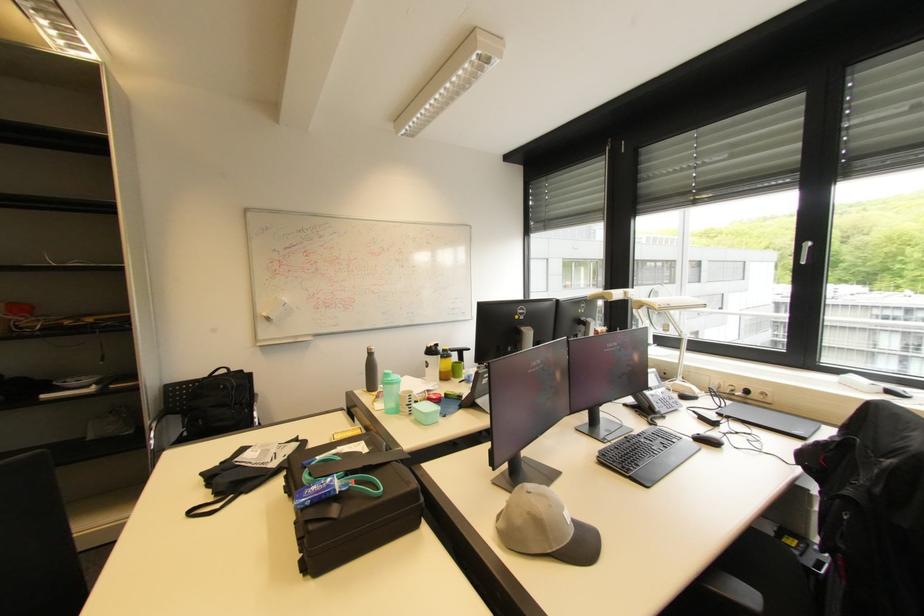
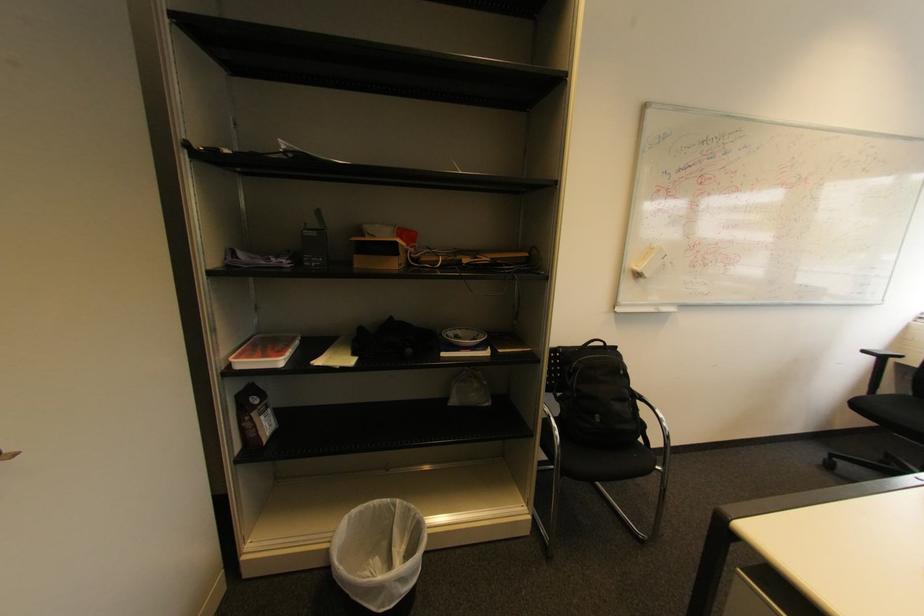
Where in the second image is the point corresponding to (x=273, y=320) from the first image?

(643, 276)